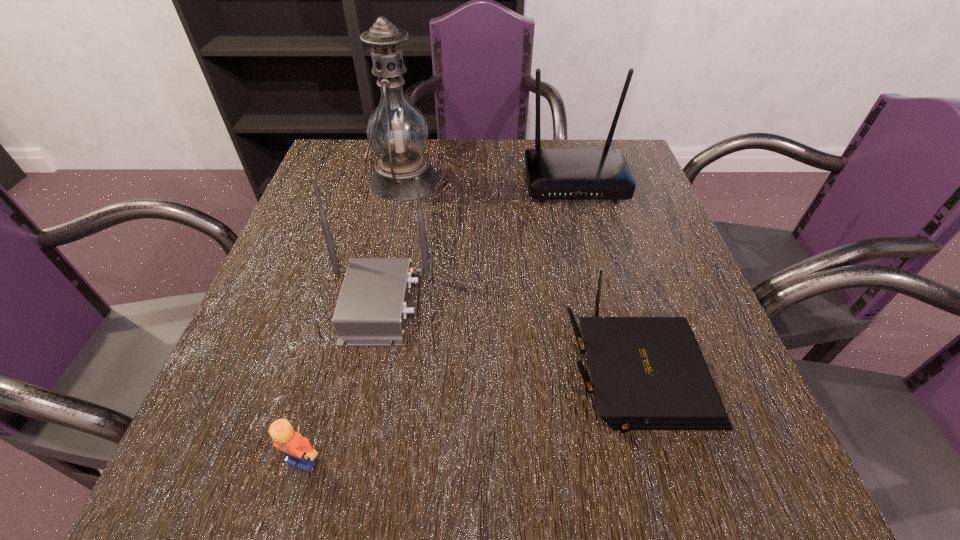
Locate an element on the screen. The height and width of the screenshot is (540, 960). router positioned at the far edge is located at coordinates (552, 174).

The width and height of the screenshot is (960, 540). What are the coordinates of `router that is at the near edge` in the screenshot? It's located at (648, 373).

This screenshot has height=540, width=960. Identify the location of Lego that is positioned at the near edge. (298, 449).

Where is `oil lamp present at the left edge`? The width and height of the screenshot is (960, 540). oil lamp present at the left edge is located at coordinates (397, 132).

Find the location of a particular element. router that is at the left edge is located at coordinates (371, 310).

At what (x,y) coordinates should I click in order to perform the action: click on Lego present at the left edge. Please return your answer as a coordinate pair (x, y). Looking at the image, I should click on (298, 449).

The image size is (960, 540). In order to click on object situated at the far left corner in this screenshot , I will do `click(397, 132)`.

The height and width of the screenshot is (540, 960). I want to click on object located in the near left corner section of the desktop, so click(x=298, y=449).

You are a GUI agent. You are given a task and a screenshot of the screen. Output one action in this format:
    pyautogui.click(x=<x>, y=<y>)
    Task: Click on the object at the far right corner
    
    Given the screenshot: What is the action you would take?
    pyautogui.click(x=552, y=174)

Where is `object located at the near right corner`? This screenshot has width=960, height=540. object located at the near right corner is located at coordinates (648, 373).